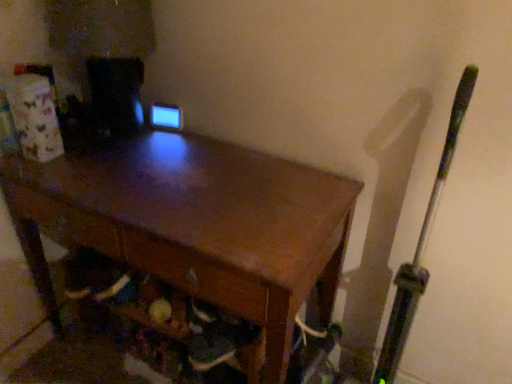
Question: Is wooden drawer at lower center to the left or to the right of wooden desk at center in the image?

Choices:
 (A) left
 (B) right

Answer: (A)

Question: Relative to wooden desk at center, is wooden drawer at lower center in front or behind?

Choices:
 (A) front
 (B) behind

Answer: (B)

Question: Which of these objects is positioned closest to the wooden desk at center?

Choices:
 (A) green metallic bat at right
 (B) wooden drawer at lower center

Answer: (B)

Question: Based on their relative distances, which object is nearer to the wooden desk at center?

Choices:
 (A) green metallic bat at right
 (B) wooden drawer at lower center

Answer: (B)